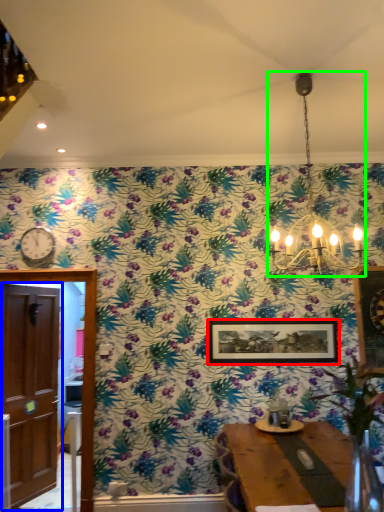
Question: Which is nearer to the picture frame (highlighted by a red box)? door (highlighted by a blue box) or light fixture (highlighted by a green box).

Choices:
 (A) door
 (B) light fixture

Answer: (B)